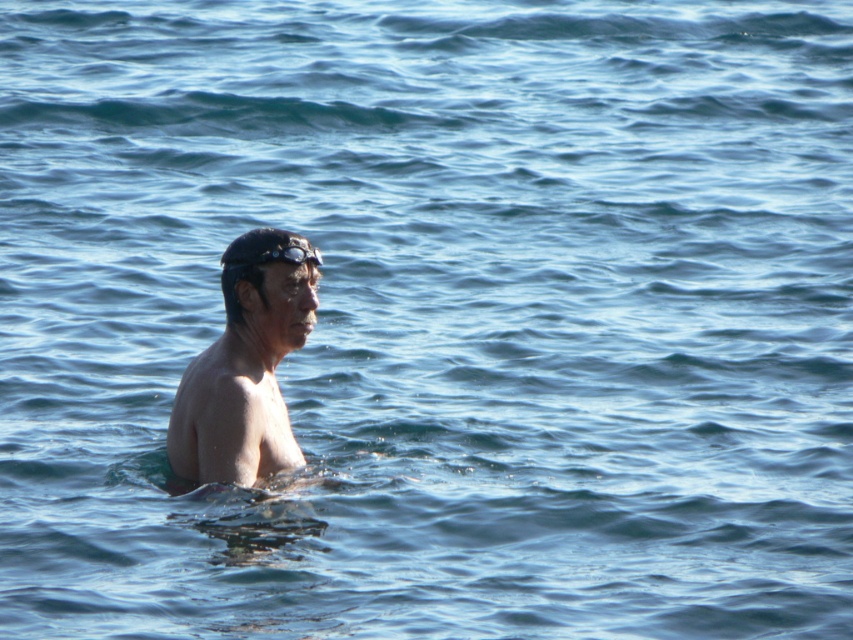
Question: Estimate the real-world distances between objects in this image. Which object is farther from the black matte swim cap at center?

Choices:
 (A) transparent rubber goggles at center
 (B) matte black swim cap at center

Answer: (B)

Question: Is matte black swim cap at center to the right of black matte swim cap at center from the viewer's perspective?

Choices:
 (A) yes
 (B) no

Answer: (A)

Question: Estimate the real-world distances between objects in this image. Which object is farther from the black matte swim cap at center?

Choices:
 (A) matte black swim cap at center
 (B) transparent rubber goggles at center

Answer: (A)

Question: Does black matte swim cap at center appear under transparent rubber goggles at center?

Choices:
 (A) yes
 (B) no

Answer: (A)

Question: Can you confirm if black matte swim cap at center is bigger than transparent rubber goggles at center?

Choices:
 (A) yes
 (B) no

Answer: (A)

Question: Which object appears closest to the camera in this image?

Choices:
 (A) matte black swim cap at center
 (B) black matte swim cap at center
 (C) transparent rubber goggles at center

Answer: (A)